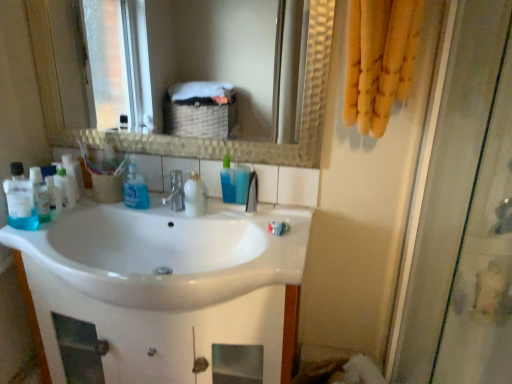
Question: Is translucent plastic bottles at left, which ranks as the fourth cleaning product in right-to-left order, taller than blue translucent bottle at center, the 1th mouthwash when ordered from right to left?

Choices:
 (A) no
 (B) yes

Answer: (B)

Question: Does translucent plastic bottles at left, which ranks as the fourth cleaning product in right-to-left order, contain blue translucent bottle at center, the second mouthwash positioned from the front?

Choices:
 (A) no
 (B) yes

Answer: (A)

Question: From a real-world perspective, is translucent plastic bottles at left, which is the first cleaning product in left-to-right order, under blue translucent bottle at center, which ranks as the first mouthwash in back-to-front order?

Choices:
 (A) yes
 (B) no

Answer: (A)

Question: Is translucent plastic bottles at left, which is the first cleaning product in left-to-right order, at the left side of blue translucent bottle at center, which ranks as the first mouthwash in back-to-front order?

Choices:
 (A) yes
 (B) no

Answer: (A)

Question: Is translucent plastic bottles at left, which ranks as the fourth cleaning product in right-to-left order, not close to blue translucent bottle at center, the 1th mouthwash when ordered from right to left?

Choices:
 (A) yes
 (B) no

Answer: (B)

Question: Is translucent plastic bottles at left, which is the first cleaning product in left-to-right order, closer to the viewer compared to blue translucent bottle at center, the second mouthwash in the left-to-right sequence?

Choices:
 (A) yes
 (B) no

Answer: (A)

Question: Can we say blue translucent bottle at center, which appears as the fourth cleaning product when viewed from the left, lies outside blue translucent bottle at center, the second mouthwash positioned from the front?

Choices:
 (A) no
 (B) yes

Answer: (B)

Question: Are blue translucent bottle at center, which appears as the fourth cleaning product when viewed from the left, and blue translucent bottle at center, the second mouthwash positioned from the front, located far from each other?

Choices:
 (A) no
 (B) yes

Answer: (A)

Question: Is blue translucent bottle at center, arranged as the 1th cleaning product when viewed from the right, facing away from blue translucent bottle at center, which ranks as the first mouthwash in back-to-front order?

Choices:
 (A) yes
 (B) no

Answer: (B)

Question: Is blue translucent bottle at center, which appears as the fourth cleaning product when viewed from the left, to the left of blue translucent bottle at center, the second mouthwash in the left-to-right sequence, from the viewer's perspective?

Choices:
 (A) no
 (B) yes

Answer: (B)

Question: Considering the relative positions of blue translucent bottle at center, arranged as the 1th cleaning product when viewed from the right, and blue translucent bottle at center, the second mouthwash in the left-to-right sequence, in the image provided, is blue translucent bottle at center, arranged as the 1th cleaning product when viewed from the right, behind blue translucent bottle at center, the second mouthwash in the left-to-right sequence,?

Choices:
 (A) yes
 (B) no

Answer: (B)

Question: Is the position of blue translucent bottle at center, which appears as the fourth cleaning product when viewed from the left, less distant than that of blue translucent bottle at center, the second mouthwash in the left-to-right sequence?

Choices:
 (A) no
 (B) yes

Answer: (B)

Question: Is white glossy toothpaste at center surrounded by transparent glass shower door at right?

Choices:
 (A) yes
 (B) no

Answer: (B)